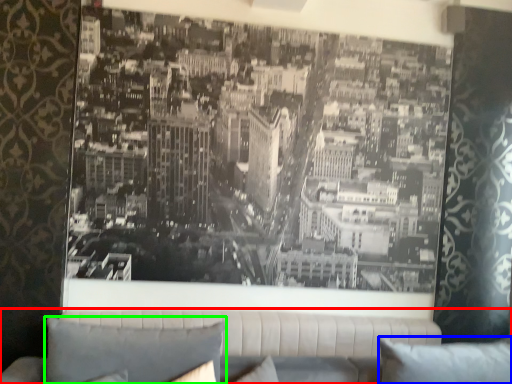
Question: Which object is the farthest from studio couch (highlighted by a red box)? Choose among these: pillow (highlighted by a blue box) or pillow (highlighted by a green box).

Choices:
 (A) pillow
 (B) pillow

Answer: (B)